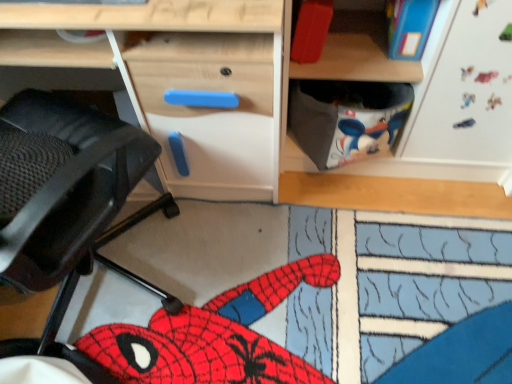
Question: From the image's perspective, is black mesh swivel chair at left above or below wooden desk at center?

Choices:
 (A) below
 (B) above

Answer: (A)

Question: Is black mesh swivel chair at left to the left or to the right of wooden desk at center in the image?

Choices:
 (A) left
 (B) right

Answer: (A)

Question: Considering the positions of black mesh swivel chair at left and wooden desk at center in the image, is black mesh swivel chair at left taller or shorter than wooden desk at center?

Choices:
 (A) tall
 (B) short

Answer: (A)

Question: Is point (202, 137) positioned closer to the camera than point (51, 226)?

Choices:
 (A) farther
 (B) closer

Answer: (A)

Question: In terms of size, does wooden desk at center appear bigger or smaller than black mesh swivel chair at left?

Choices:
 (A) big
 (B) small

Answer: (B)

Question: Considering the positions of wooden desk at center and black mesh swivel chair at left in the image, is wooden desk at center wider or thinner than black mesh swivel chair at left?

Choices:
 (A) wide
 (B) thin

Answer: (B)

Question: From the image's perspective, is wooden desk at center above or below black mesh swivel chair at left?

Choices:
 (A) below
 (B) above

Answer: (B)